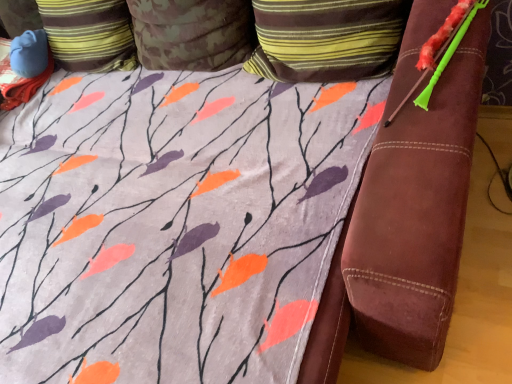
What do you see at coordinates (89, 34) in the screenshot?
I see `camouflage fabric pillow at upper left, the third pillow in the right-to-left sequence` at bounding box center [89, 34].

The image size is (512, 384). Describe the element at coordinates (326, 39) in the screenshot. I see `striped fabric pillow at upper center, which appears as the third pillow when viewed from the left` at that location.

In order to face striped fabric pillow at upper center, arranged as the 1th pillow when viewed from the right, should I rotate leftwards or rightwards?

Turn right by 8.598 degrees to look at striped fabric pillow at upper center, arranged as the 1th pillow when viewed from the right.

The height and width of the screenshot is (384, 512). What do you see at coordinates (192, 33) in the screenshot? I see `camouflage fabric pillow at upper center, which is counted as the second pillow, starting from the right` at bounding box center [192, 33].

Image resolution: width=512 pixels, height=384 pixels. In order to click on camouflage fabric pillow at upper left, arranged as the 1th pillow when viewed from the left in this screenshot , I will do `click(89, 34)`.

Would you say camouflage fabric pillow at upper left, arranged as the 1th pillow when viewed from the left, is outside striped fabric pillow at upper center, which appears as the third pillow when viewed from the left?

That's correct, camouflage fabric pillow at upper left, arranged as the 1th pillow when viewed from the left, is outside of striped fabric pillow at upper center, which appears as the third pillow when viewed from the left.

Consider the image. From a real-world perspective, which is physically above, camouflage fabric pillow at upper left, the third pillow in the right-to-left sequence, or striped fabric pillow at upper center, which appears as the third pillow when viewed from the left?

camouflage fabric pillow at upper left, the third pillow in the right-to-left sequence, is physically above.

From the image's perspective, which is above, camouflage fabric pillow at upper left, arranged as the 1th pillow when viewed from the left, or striped fabric pillow at upper center, arranged as the 1th pillow when viewed from the right?

From the image's view, camouflage fabric pillow at upper left, arranged as the 1th pillow when viewed from the left, is above.

How different are the orientations of camouflage fabric pillow at upper left, arranged as the 1th pillow when viewed from the left, and striped fabric pillow at upper center, arranged as the 1th pillow when viewed from the right, in degrees?

The angular difference between camouflage fabric pillow at upper left, arranged as the 1th pillow when viewed from the left, and striped fabric pillow at upper center, arranged as the 1th pillow when viewed from the right, is 0.000153 degrees.

Looking at this image, does camouflage fabric pillow at upper center, which is counted as the second pillow, starting from the right, have a greater height compared to striped fabric pillow at upper center, which appears as the third pillow when viewed from the left?

Yes, camouflage fabric pillow at upper center, which is counted as the second pillow, starting from the right, is taller than striped fabric pillow at upper center, which appears as the third pillow when viewed from the left.

Is camouflage fabric pillow at upper center, which is counted as the second pillow, starting from the right, oriented towards striped fabric pillow at upper center, which appears as the third pillow when viewed from the left?

No, camouflage fabric pillow at upper center, which is counted as the second pillow, starting from the right, is not aimed at striped fabric pillow at upper center, which appears as the third pillow when viewed from the left.

Is point (198, 33) farther from viewer compared to point (270, 27)?

Yes, point (198, 33) is behind point (270, 27).

Is point (331, 71) positioned before point (39, 0)?

Yes, point (331, 71) is in front of point (39, 0).

Based on the photo, between striped fabric pillow at upper center, arranged as the 1th pillow when viewed from the right, and camouflage fabric pillow at upper left, arranged as the 1th pillow when viewed from the left, which one is positioned in front?

striped fabric pillow at upper center, arranged as the 1th pillow when viewed from the right.

Is camouflage fabric pillow at upper left, the third pillow in the right-to-left sequence, positioned behind camouflage fabric pillow at upper center, arranged as the 2th pillow when viewed from the left?

Yes.

Consider the image. Between camouflage fabric pillow at upper left, arranged as the 1th pillow when viewed from the left, and camouflage fabric pillow at upper center, arranged as the 2th pillow when viewed from the left, which one has smaller size?

Smaller between the two is camouflage fabric pillow at upper center, arranged as the 2th pillow when viewed from the left.

Does camouflage fabric pillow at upper left, arranged as the 1th pillow when viewed from the left, have a greater height compared to camouflage fabric pillow at upper center, which is counted as the second pillow, starting from the right?

Yes, camouflage fabric pillow at upper left, arranged as the 1th pillow when viewed from the left, is taller than camouflage fabric pillow at upper center, which is counted as the second pillow, starting from the right.

Measure the distance from striped fabric pillow at upper center, which appears as the third pillow when viewed from the left, to camouflage fabric pillow at upper center, which is counted as the second pillow, starting from the right.

striped fabric pillow at upper center, which appears as the third pillow when viewed from the left, and camouflage fabric pillow at upper center, which is counted as the second pillow, starting from the right, are 11.94 inches apart.

Which of these two, striped fabric pillow at upper center, arranged as the 1th pillow when viewed from the right, or camouflage fabric pillow at upper center, arranged as the 2th pillow when viewed from the left, is smaller?

Smaller between the two is camouflage fabric pillow at upper center, arranged as the 2th pillow when viewed from the left.

Can you confirm if striped fabric pillow at upper center, arranged as the 1th pillow when viewed from the right, is positioned to the left of camouflage fabric pillow at upper center, which is counted as the second pillow, starting from the right?

In fact, striped fabric pillow at upper center, arranged as the 1th pillow when viewed from the right, is to the right of camouflage fabric pillow at upper center, which is counted as the second pillow, starting from the right.

In the scene shown: Considering the relative sizes of striped fabric pillow at upper center, arranged as the 1th pillow when viewed from the right, and camouflage fabric pillow at upper center, arranged as the 2th pillow when viewed from the left, in the image provided, is striped fabric pillow at upper center, arranged as the 1th pillow when viewed from the right, taller than camouflage fabric pillow at upper center, arranged as the 2th pillow when viewed from the left,?

No, striped fabric pillow at upper center, arranged as the 1th pillow when viewed from the right, is not taller than camouflage fabric pillow at upper center, arranged as the 2th pillow when viewed from the left.

In order to click on pillow that is behind the camouflage fabric pillow at upper center, arranged as the 2th pillow when viewed from the left in this screenshot , I will do `click(89, 34)`.

Based on the photo, is camouflage fabric pillow at upper center, which is counted as the second pillow, starting from the right, positioned behind camouflage fabric pillow at upper left, arranged as the 1th pillow when viewed from the left?

No, camouflage fabric pillow at upper center, which is counted as the second pillow, starting from the right, is closer to the viewer.

Could you measure the distance between camouflage fabric pillow at upper center, which is counted as the second pillow, starting from the right, and camouflage fabric pillow at upper left, arranged as the 1th pillow when viewed from the left?

camouflage fabric pillow at upper center, which is counted as the second pillow, starting from the right, and camouflage fabric pillow at upper left, arranged as the 1th pillow when viewed from the left, are 11.05 inches apart from each other.

Is camouflage fabric pillow at upper center, which is counted as the second pillow, starting from the right, aimed at camouflage fabric pillow at upper left, the third pillow in the right-to-left sequence?

No.

The image size is (512, 384). I want to click on the 2nd pillow behind the striped fabric pillow at upper center, which appears as the third pillow when viewed from the left, so click(89, 34).

Identify the location of pillow lying in front of the camouflage fabric pillow at upper center, arranged as the 2th pillow when viewed from the left. (326, 39).

Looking at the image, which one is located further to camouflage fabric pillow at upper center, which is counted as the second pillow, starting from the right, striped fabric pillow at upper center, which appears as the third pillow when viewed from the left, or camouflage fabric pillow at upper left, arranged as the 1th pillow when viewed from the left?

striped fabric pillow at upper center, which appears as the third pillow when viewed from the left, lies further to camouflage fabric pillow at upper center, which is counted as the second pillow, starting from the right, than the other object.

Looking at the image, which one is located closer to camouflage fabric pillow at upper left, the third pillow in the right-to-left sequence, striped fabric pillow at upper center, which appears as the third pillow when viewed from the left, or camouflage fabric pillow at upper center, arranged as the 2th pillow when viewed from the left?

The object closer to camouflage fabric pillow at upper left, the third pillow in the right-to-left sequence, is camouflage fabric pillow at upper center, arranged as the 2th pillow when viewed from the left.

Estimate the real-world distances between objects in this image. Which object is further from camouflage fabric pillow at upper center, arranged as the 2th pillow when viewed from the left, camouflage fabric pillow at upper left, the third pillow in the right-to-left sequence, or striped fabric pillow at upper center, which appears as the third pillow when viewed from the left?

striped fabric pillow at upper center, which appears as the third pillow when viewed from the left, is positioned further to the anchor camouflage fabric pillow at upper center, arranged as the 2th pillow when viewed from the left.

Based on their spatial positions, is camouflage fabric pillow at upper center, which is counted as the second pillow, starting from the right, or camouflage fabric pillow at upper left, arranged as the 1th pillow when viewed from the left, closer to striped fabric pillow at upper center, which appears as the third pillow when viewed from the left?

camouflage fabric pillow at upper center, which is counted as the second pillow, starting from the right, lies closer to striped fabric pillow at upper center, which appears as the third pillow when viewed from the left, than the other object.

When comparing their distances from striped fabric pillow at upper center, arranged as the 1th pillow when viewed from the right, does camouflage fabric pillow at upper left, arranged as the 1th pillow when viewed from the left, or camouflage fabric pillow at upper center, which is counted as the second pillow, starting from the right, seem further?

camouflage fabric pillow at upper left, arranged as the 1th pillow when viewed from the left, is further to striped fabric pillow at upper center, arranged as the 1th pillow when viewed from the right.

Looking at the image, which one is located closer to camouflage fabric pillow at upper left, the third pillow in the right-to-left sequence, camouflage fabric pillow at upper center, which is counted as the second pillow, starting from the right, or striped fabric pillow at upper center, which appears as the third pillow when viewed from the left?

Based on the image, camouflage fabric pillow at upper center, which is counted as the second pillow, starting from the right, appears to be nearer to camouflage fabric pillow at upper left, the third pillow in the right-to-left sequence.

At what (x,y) coordinates should I click in order to perform the action: click on pillow located between camouflage fabric pillow at upper left, the third pillow in the right-to-left sequence, and striped fabric pillow at upper center, arranged as the 1th pillow when viewed from the right, in the left-right direction. Please return your answer as a coordinate pair (x, y). Image resolution: width=512 pixels, height=384 pixels. Looking at the image, I should click on (192, 33).